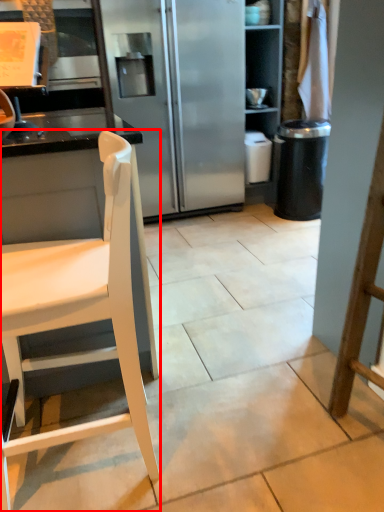
Question: Where is chair (annotated by the red box) located in relation to trash bin/can in the image?

Choices:
 (A) right
 (B) left

Answer: (B)